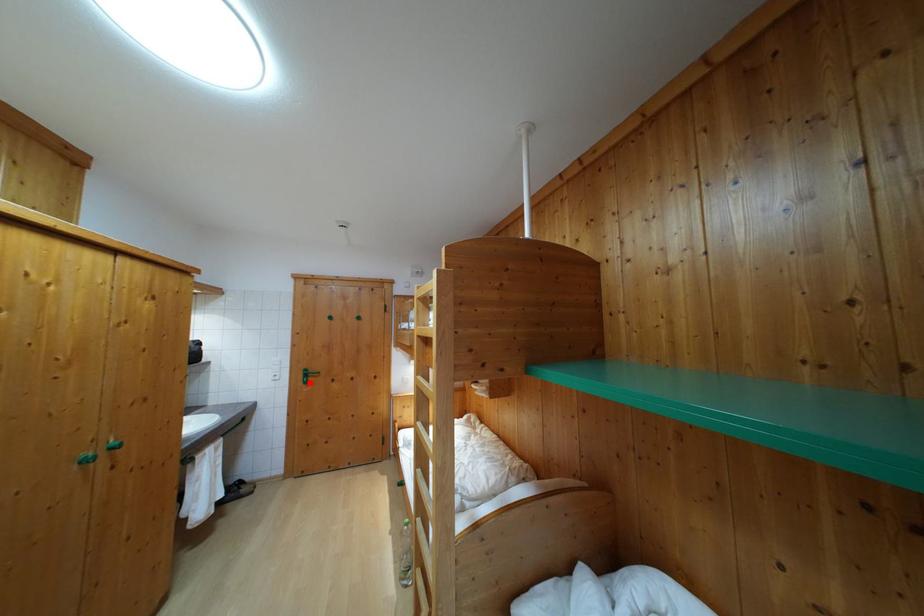
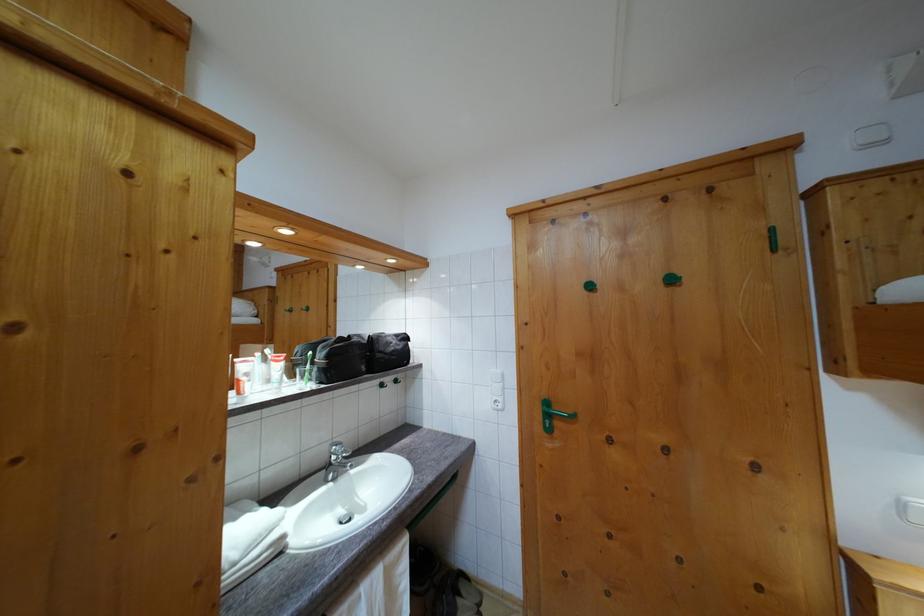
In the second image, find the point that corresponds to the highlighted location in the first image.

(552, 422)